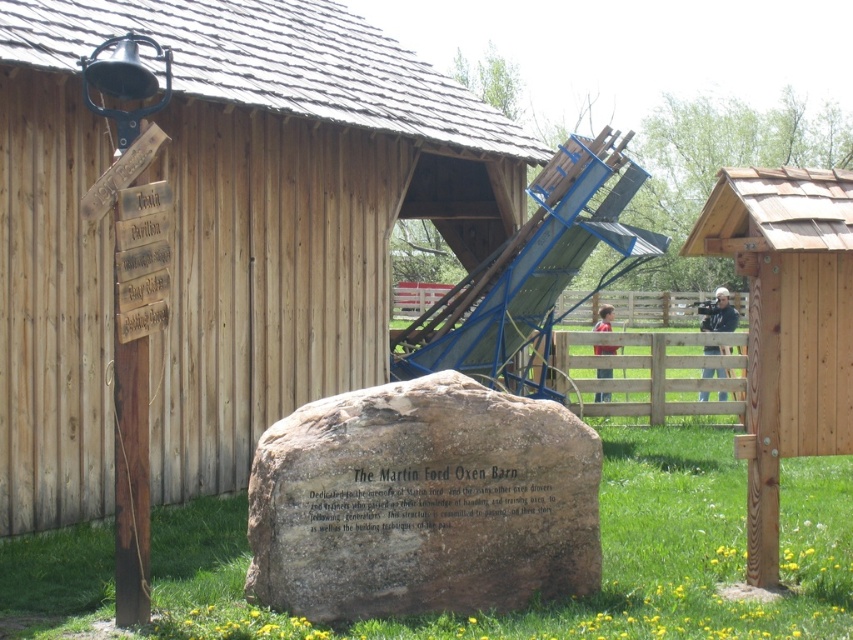
Does green grass at center have a lesser height compared to brown rough stone at center?

Correct, green grass at center is not as tall as brown rough stone at center.

Where is `green grass at center`? green grass at center is located at coordinates (602, 554).

Who is lower down, wooden hut at center or green grass at center?

Positioned lower is green grass at center.

Is wooden hut at center taller than green grass at center?

Correct, wooden hut at center is much taller as green grass at center.

Is point (4, 115) farther from camera compared to point (704, 618)?

Yes, point (4, 115) is behind point (704, 618).

You are a GUI agent. You are given a task and a screenshot of the screen. Output one action in this format:
    pyautogui.click(x=<x>, y=<y>)
    Task: Click on the wooden hut at center
    The image size is (853, 640).
    Given the screenshot: What is the action you would take?
    pyautogui.click(x=221, y=230)

Can you confirm if wooden hut at center is positioned to the right of wooden fence at center?

No, wooden hut at center is not to the right of wooden fence at center.

Which of these two, wooden hut at center or wooden fence at center, stands taller?

With more height is wooden fence at center.

Describe the element at coordinates (221, 230) in the screenshot. I see `wooden hut at center` at that location.

Find the location of a particular element. wooden hut at center is located at coordinates coord(221,230).